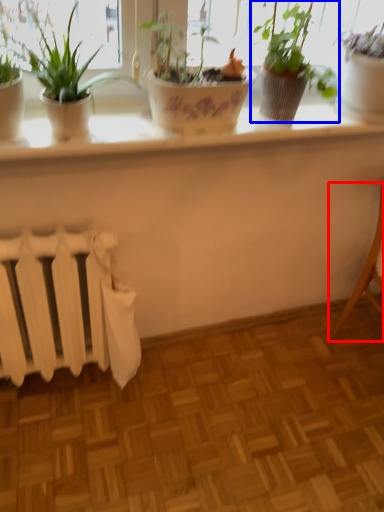
Question: Which of the following is the farthest to the observer, armchair (highlighted by a red box) or houseplant (highlighted by a blue box)?

Choices:
 (A) armchair
 (B) houseplant

Answer: (A)